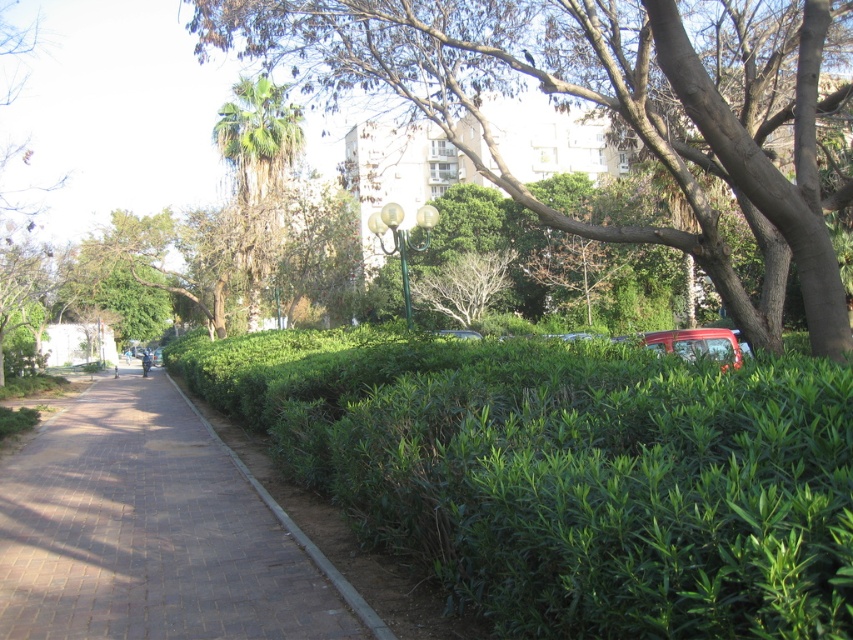
Question: From the image, what is the correct spatial relationship of green leafy tree at center in relation to green leafy palm tree at center?

Choices:
 (A) left
 (B) right

Answer: (B)

Question: Which object appears closest to the camera in this image?

Choices:
 (A) green leafy palm tree at center
 (B) green leafy tree at center

Answer: (B)

Question: Among these objects, which one is nearest to the camera?

Choices:
 (A) metallic red car at right
 (B) green leafy hedge at center

Answer: (B)

Question: Does green leafy hedge at center have a greater width compared to brick paved sidewalk at center?

Choices:
 (A) no
 (B) yes

Answer: (A)

Question: Does green leafy hedge at center appear on the left side of green leafy tree at center?

Choices:
 (A) no
 (B) yes

Answer: (B)

Question: Which point is closer to the camera?

Choices:
 (A) (635, 49)
 (B) (305, 424)
 (C) (97, 465)

Answer: (B)